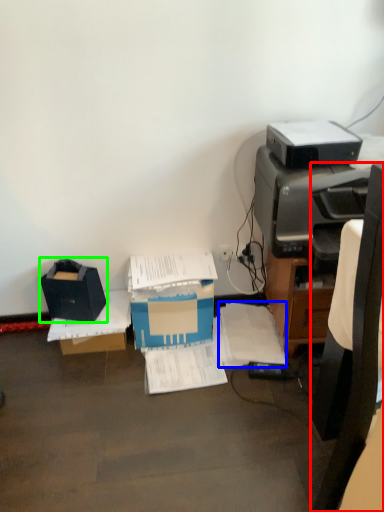
Question: Based on their relative distances, which object is farther from chair (highlighted by a red box)? Choose from document (highlighted by a blue box) and storage box (highlighted by a green box).

Choices:
 (A) document
 (B) storage box

Answer: (B)